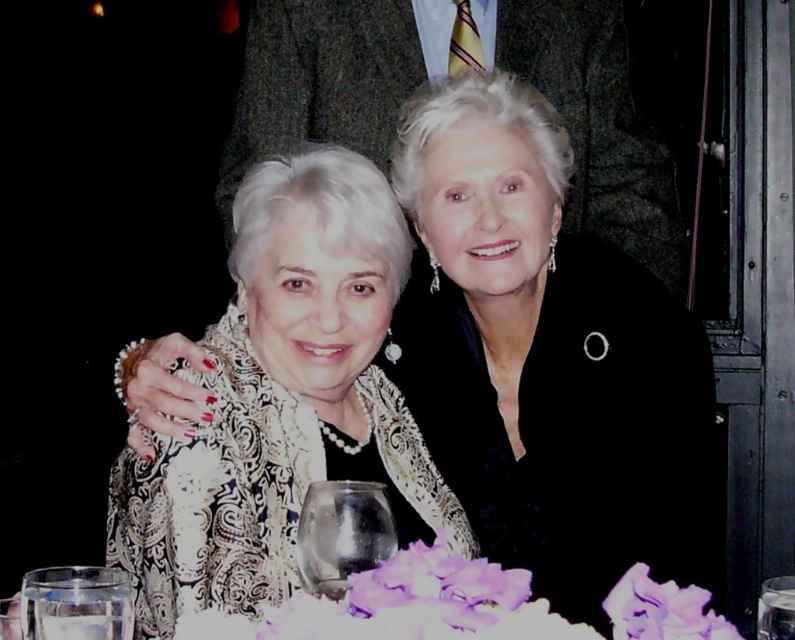
You are a photographer at a formal event. You need to capture a photo of the white lace dress at center and the transparent glass wine glass at lower center. Based on their sizes, which object should you focus on first to ensure both are in frame?

The white lace dress at center might be wider than transparent glass wine glass at lower center, so you should focus on the white lace dress at center first to ensure it fits within the frame before adjusting for the smaller glass.

From the picture: You are a photographer at a formal event and need to position two dresses in the frame so that the taller one is centered. Given the black satin dress at center and the white lace dress at center, which dress should be placed in the center to ensure the taller one is centered?

The black satin dress at center is taller than the white lace dress at center, so the black satin dress at center should be placed in the center to ensure the taller one is centered.